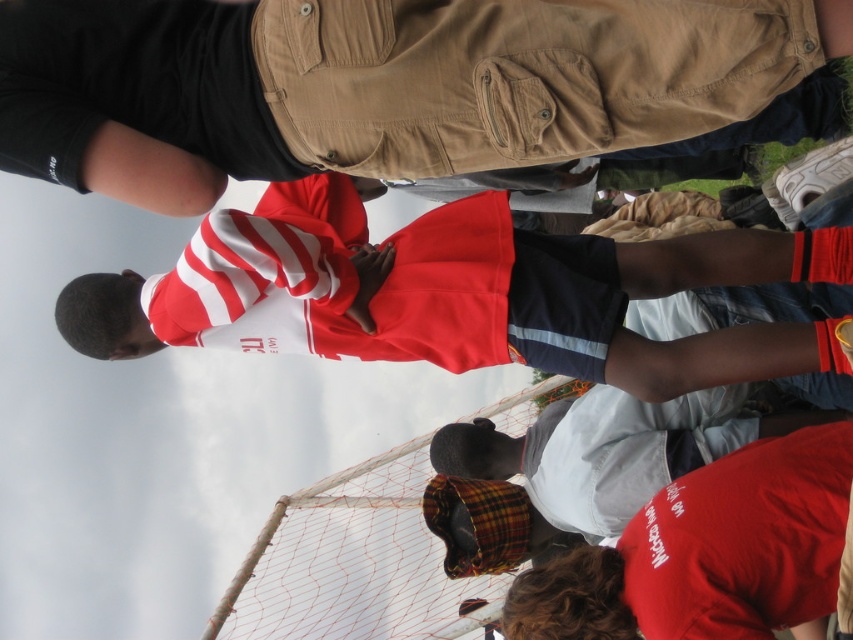
You are a photographer trying to capture a clear shot of the red and white striped shirt at center and the matte khaki cargo pants at center. Which object should you focus on first to ensure it appears sharp in the photo?

You should focus on the matte khaki cargo pants at center first because it is closer to the viewer than the red and white striped shirt at center, so focusing on the closer object ensures depth of field includes both.